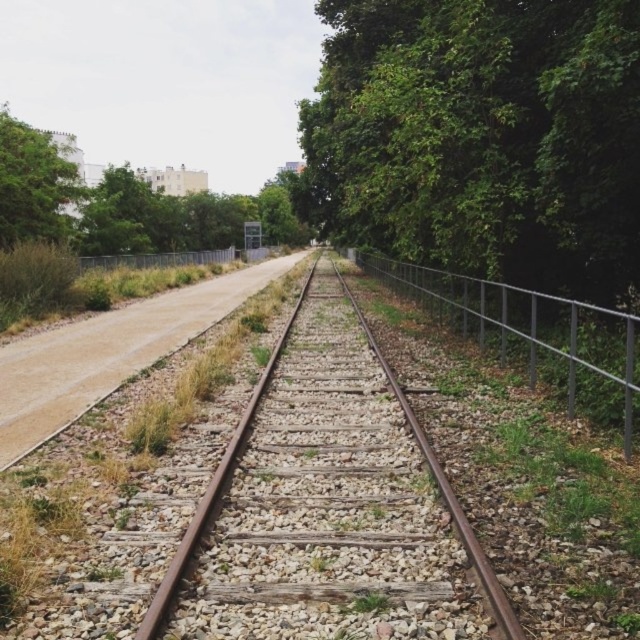
Question: Which point is closer to the camera taking this photo?

Choices:
 (A) (228, 278)
 (B) (433, 611)

Answer: (B)

Question: Which object appears closest to the camera in this image?

Choices:
 (A) green leafy tree at center
 (B) brown gravel dirt track at left

Answer: (B)

Question: Is green leafy tree at center in front of brown gravel dirt track at left?

Choices:
 (A) yes
 (B) no

Answer: (B)

Question: From the image, what is the correct spatial relationship of green leafy tree at center in relation to brown gravel dirt track at left?

Choices:
 (A) below
 (B) above

Answer: (B)

Question: Is brown metal train track at center further to camera compared to brown gravel dirt track at left?

Choices:
 (A) yes
 (B) no

Answer: (B)

Question: Which of the following is the farthest from the observer?

Choices:
 (A) (486, 317)
 (B) (33, 348)
 (C) (58, 180)

Answer: (C)